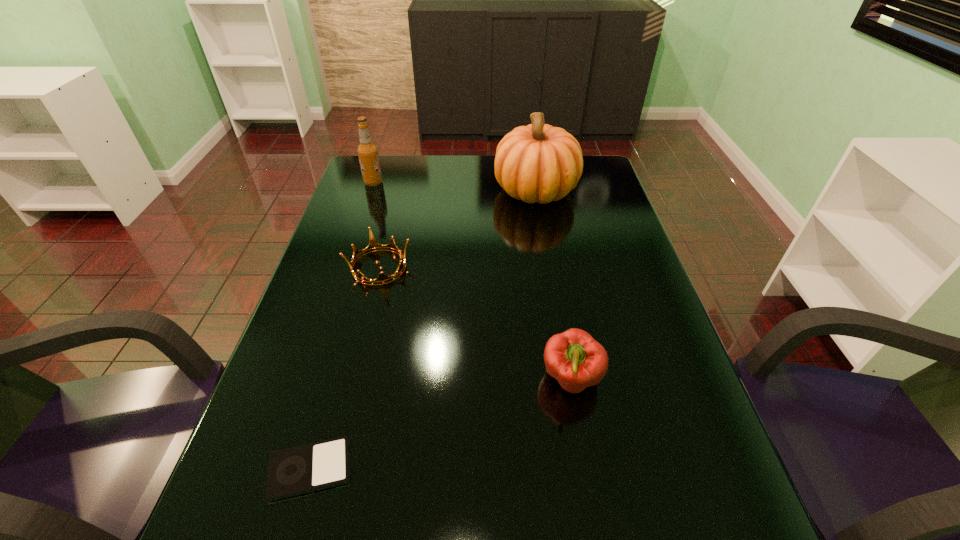
Identify the location of free space between the bell pepper and the pumpkin. (554, 285).

At what (x,y) coordinates should I click in order to perform the action: click on vacant area that lies between the bell pepper and the pumpkin. Please return your answer as a coordinate pair (x, y). The image size is (960, 540). Looking at the image, I should click on (554, 285).

Where is `free space between the shortest object and the third farthest object`? The height and width of the screenshot is (540, 960). free space between the shortest object and the third farthest object is located at coordinates (345, 368).

This screenshot has height=540, width=960. Find the location of `empty space that is in between the beer bottle and the pumpkin`. empty space that is in between the beer bottle and the pumpkin is located at coordinates (455, 187).

This screenshot has height=540, width=960. Find the location of `empty location between the nearest object and the pumpkin`. empty location between the nearest object and the pumpkin is located at coordinates (423, 330).

Locate which object is the fourth closest to the third shortest object. Please provide its 2D coordinates. Your answer should be formatted as a tuple, i.e. [(x, y)], where the tuple contains the x and y coordinates of a point satisfying the conditions above.

[(367, 151)]

Locate an element on the screen. This screenshot has width=960, height=540. the closest object relative to the bell pepper is located at coordinates (298, 470).

Find the location of `free space that satisfies the following two spatial constraints: 1. on the front label of the beer bottle; 2. on the back side of the nearest object`. free space that satisfies the following two spatial constraints: 1. on the front label of the beer bottle; 2. on the back side of the nearest object is located at coordinates (277, 469).

Where is `vacant space that satisfies the following two spatial constraints: 1. on the front label of the beer bottle; 2. on the back side of the iPod`? The image size is (960, 540). vacant space that satisfies the following two spatial constraints: 1. on the front label of the beer bottle; 2. on the back side of the iPod is located at coordinates (277, 469).

Locate an element on the screen. The height and width of the screenshot is (540, 960). vacant area that satisfies the following two spatial constraints: 1. on the front side of the third tallest object; 2. on the right side of the pumpkin is located at coordinates (568, 380).